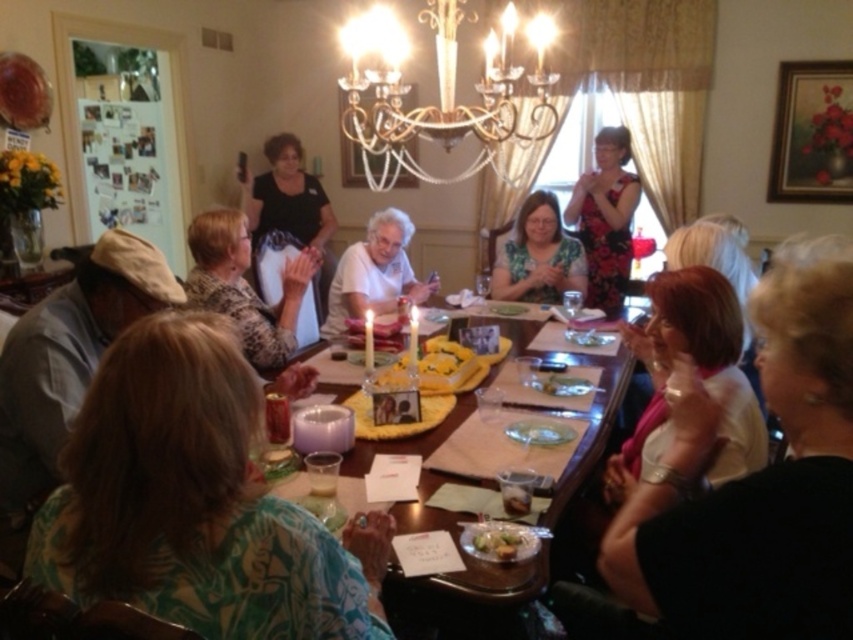
Does green floral shirt at lower left come behind green leafy salad at center?

No, green floral shirt at lower left is closer to the viewer.

Which is above, green floral shirt at lower left or green leafy salad at center?

green floral shirt at lower left is above.

Locate an element on the screen. This screenshot has height=640, width=853. green floral shirt at lower left is located at coordinates (195, 500).

Is black satin dress at upper center to the left of floral dress at upper right from the viewer's perspective?

Indeed, black satin dress at upper center is positioned on the left side of floral dress at upper right.

Does black satin dress at upper center appear under floral dress at upper right?

Incorrect, black satin dress at upper center is not positioned below floral dress at upper right.

Does point (315, 296) lie behind point (608, 186)?

That is False.

Identify the location of black satin dress at upper center. The width and height of the screenshot is (853, 640). (285, 214).

Between wooden table at center and green leafy salad at center, which one appears on the right side from the viewer's perspective?

Positioned to the right is wooden table at center.

Is wooden table at center shorter than green leafy salad at center?

In fact, wooden table at center may be taller than green leafy salad at center.

The image size is (853, 640). What do you see at coordinates (590, 436) in the screenshot?
I see `wooden table at center` at bounding box center [590, 436].

Where is `wooden table at center`? wooden table at center is located at coordinates (590, 436).